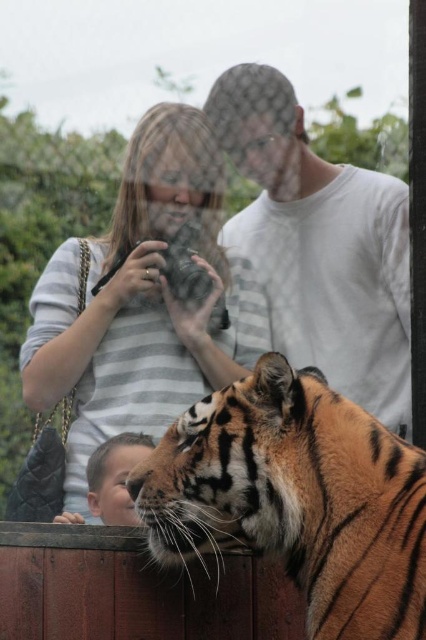
Locate an element on the screen. This screenshot has height=640, width=426. striped fabric shirt at upper center is located at coordinates (143, 301).

Is striped fabric shirt at upper center behind white cotton shirt at upper center?

That is False.

Between point (60, 333) and point (245, 212), which one is positioned behind?

Point (245, 212)

At what (x,y) coordinates should I click in order to perform the action: click on striped fabric shirt at upper center. Please return your answer as a coordinate pair (x, y). The image size is (426, 640). Looking at the image, I should click on (143, 301).

Is orange striped fur tiger at center above smooth skin face at lower left?

Yes, orange striped fur tiger at center is above smooth skin face at lower left.

Is orange striped fur tiger at center positioned in front of smooth skin face at lower left?

Yes.

At what (x,y) coordinates should I click in order to perform the action: click on orange striped fur tiger at center. Please return your answer as a coordinate pair (x, y). This screenshot has height=640, width=426. Looking at the image, I should click on (296, 497).

Who is positioned more to the left, orange striped fur tiger at center or white cotton shirt at upper center?

orange striped fur tiger at center

Is point (422, 467) farther from camera compared to point (279, 292)?

No, it is not.

You are a GUI agent. You are given a task and a screenshot of the screen. Output one action in this format:
    pyautogui.click(x=<x>, y=<y>)
    Task: Click on the orange striped fur tiger at center
    This screenshot has width=426, height=640.
    Given the screenshot: What is the action you would take?
    pyautogui.click(x=296, y=497)